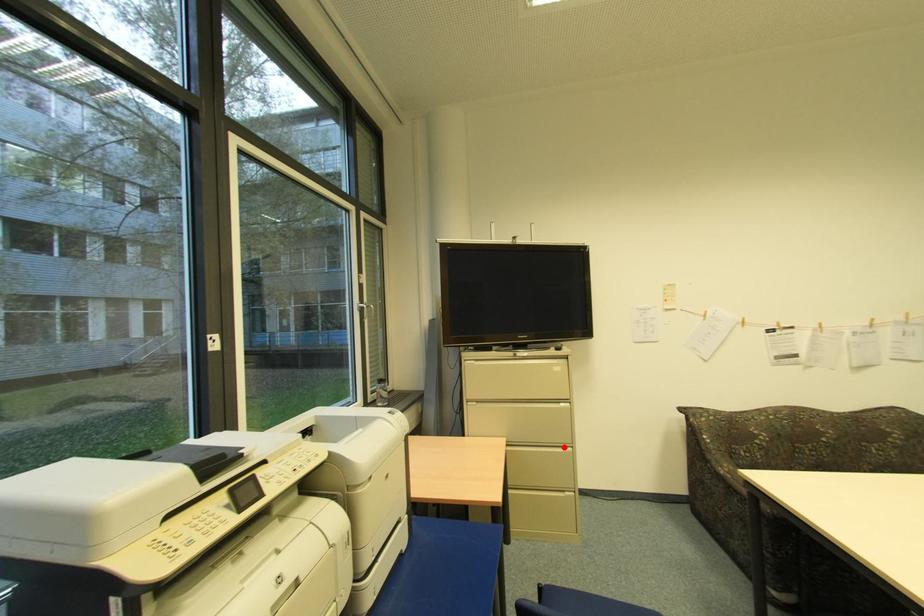
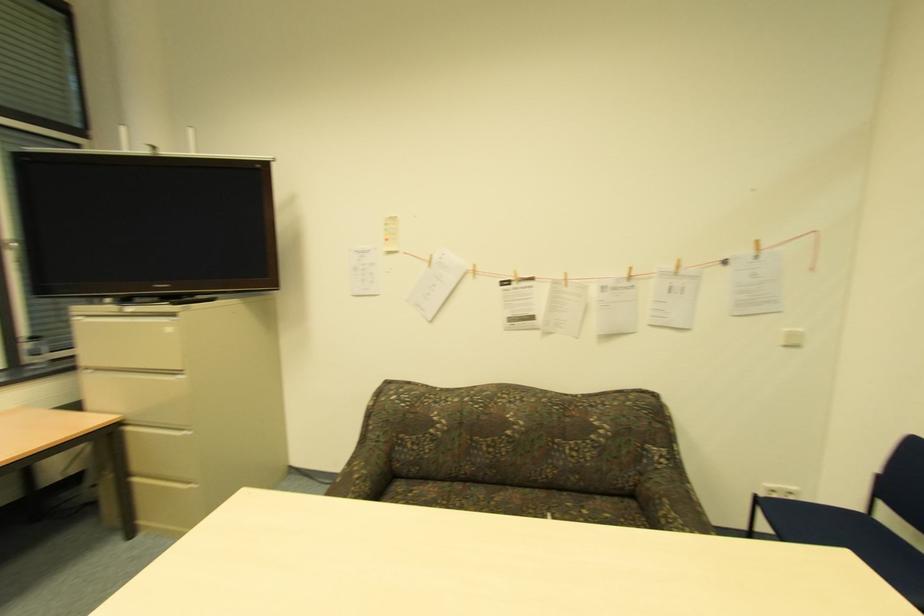
The point at the highlighted location is marked in the first image. Where is the corresponding point in the second image?

(187, 429)